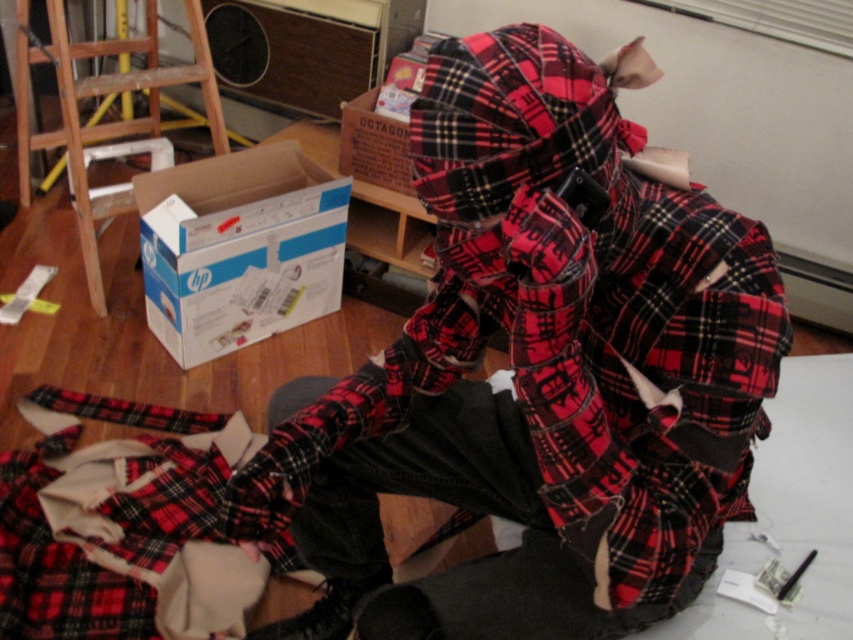
The image size is (853, 640). Describe the element at coordinates (123, 524) in the screenshot. I see `red plaid fabric at lower left` at that location.

Between red plaid fabric at lower left and wooden at left, which one is positioned lower?

red plaid fabric at lower left is lower down.

This screenshot has height=640, width=853. I want to click on red plaid fabric at lower left, so click(x=123, y=524).

Between wooden at left and cardboard box at center, which one has more height?

Standing taller between the two is wooden at left.

Is wooden at left bigger than cardboard box at center?

Correct, wooden at left is larger in size than cardboard box at center.

Between point (18, 24) and point (369, 134), which one is positioned in front?

Positioned in front is point (18, 24).

At what (x,y) coordinates should I click in order to perform the action: click on wooden at left. Please return your answer as a coordinate pair (x, y). Looking at the image, I should click on (108, 122).

Can you confirm if red plaid shirt at center is positioned to the right of red plaid fabric at lower left?

Indeed, red plaid shirt at center is positioned on the right side of red plaid fabric at lower left.

Who is positioned more to the left, red plaid shirt at center or red plaid fabric at lower left?

red plaid fabric at lower left

Describe the element at coordinates (535, 371) in the screenshot. I see `red plaid shirt at center` at that location.

Locate an element on the screen. The width and height of the screenshot is (853, 640). red plaid shirt at center is located at coordinates (535, 371).